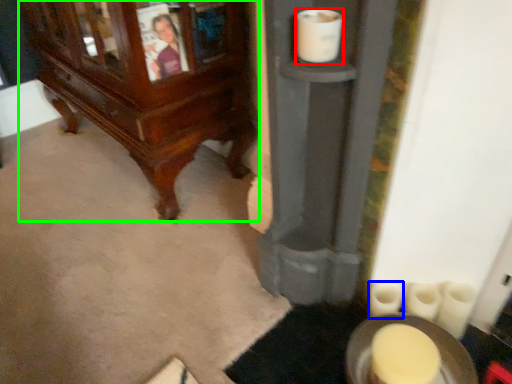
Question: Which object is the farthest from toilet paper (highlighted by a red box)? Choose among these: toilet paper (highlighted by a blue box) or furniture (highlighted by a green box).

Choices:
 (A) toilet paper
 (B) furniture

Answer: (B)